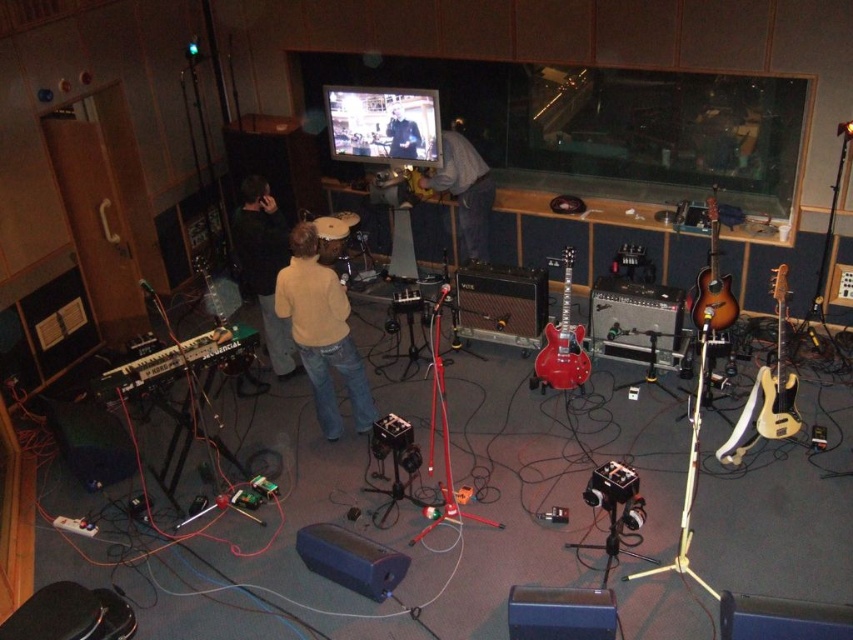
Question: Where is light brown wood electric guitar at right located in relation to sunburst wood guitar at right in the image?

Choices:
 (A) left
 (B) right

Answer: (B)

Question: Can you confirm if light brown wood electric guitar at right is smaller than sunburst wood guitar at right?

Choices:
 (A) no
 (B) yes

Answer: (B)

Question: Among these objects, which one is nearest to the camera?

Choices:
 (A) dark gray sweater at center
 (B) sunburst wood guitar at right

Answer: (B)

Question: Which of the following is the farthest from the observer?

Choices:
 (A) (397, 129)
 (B) (569, 330)
 (C) (318, 301)

Answer: (A)

Question: Can you confirm if yellow sweater at center is smaller than glossy red electric guitar at center?

Choices:
 (A) no
 (B) yes

Answer: (A)

Question: Which point is farther to the camera?

Choices:
 (A) glossy red electric guitar at center
 (B) dark gray sweater at center

Answer: (B)